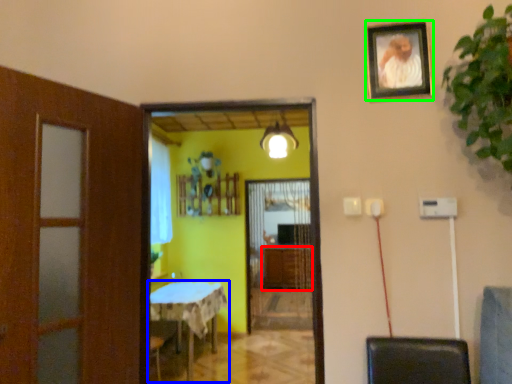
Question: Estimate the real-world distances between objects in this image. Which object is closer to cabinetry (highlighted by a red box), table (highlighted by a blue box) or picture frame (highlighted by a green box)?

Choices:
 (A) table
 (B) picture frame

Answer: (A)